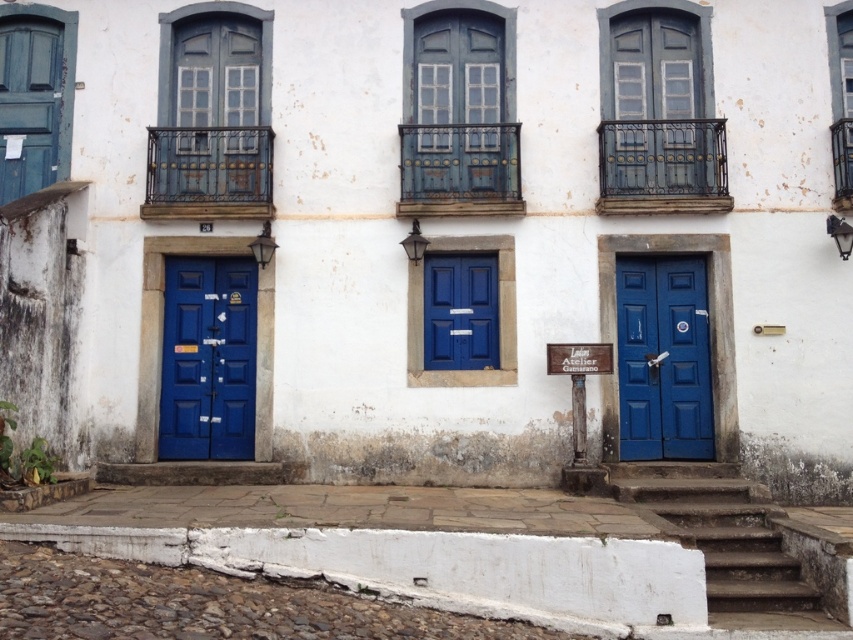
Question: Can you confirm if matte blue door at left is thinner than matte blue shutter at upper left?

Choices:
 (A) no
 (B) yes

Answer: (A)

Question: Which of these objects is positioned closest to the matte blue door at right?

Choices:
 (A) white stone stairs at lower center
 (B) matte blue door at left
 (C) matte blue shutter at upper left
 (D) matte blue door at center

Answer: (A)

Question: Which object is positioned closest to the matte blue door at center?

Choices:
 (A) matte blue shutter at upper left
 (B) matte blue door at left
 (C) matte blue door at right
 (D) white stone stairs at lower center

Answer: (C)

Question: Does matte blue door at left appear over matte blue shutter at upper left?

Choices:
 (A) no
 (B) yes

Answer: (A)

Question: Is matte blue door at left closer to the viewer compared to white stone stairs at lower center?

Choices:
 (A) yes
 (B) no

Answer: (B)

Question: Which of these objects is positioned closest to the matte blue shutter at upper left?

Choices:
 (A) matte blue door at left
 (B) matte blue door at center

Answer: (A)